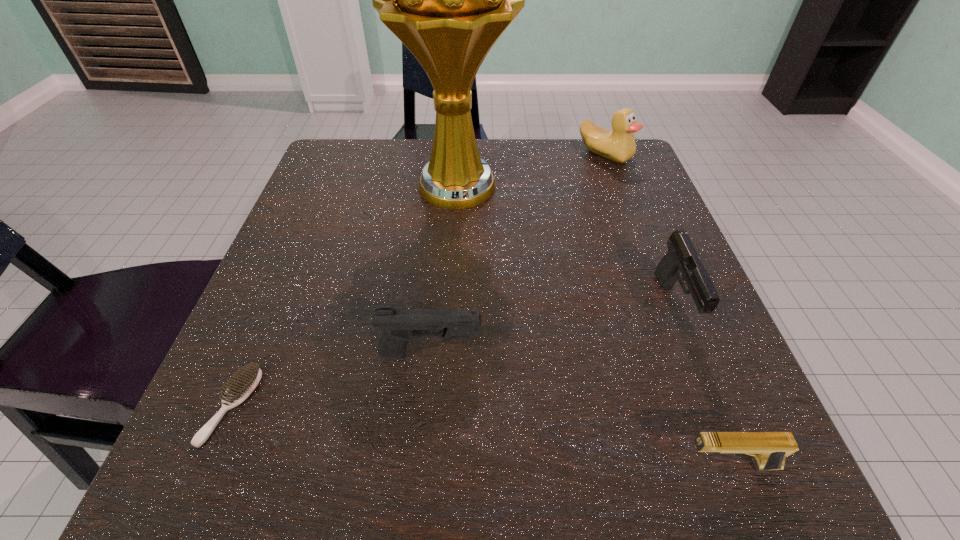
Where is `free spot located 0.260m at the beak of the duck`? free spot located 0.260m at the beak of the duck is located at coordinates (639, 245).

Find the location of `free space located aim along the barrel of the farthest pistol`. free space located aim along the barrel of the farthest pistol is located at coordinates (702, 375).

The width and height of the screenshot is (960, 540). I want to click on free space located at the barrel of the second farthest pistol, so click(x=637, y=355).

Find the location of a particular element. vacant space located at the barrel of the second shortest object is located at coordinates (401, 465).

This screenshot has height=540, width=960. Find the location of `vacant region located 0.230m at the barrel of the second shortest object`. vacant region located 0.230m at the barrel of the second shortest object is located at coordinates (492, 465).

Where is `vacant space located at the barrel of the second shortest object`? vacant space located at the barrel of the second shortest object is located at coordinates (435, 465).

In order to click on free point located on the back of the fifth farthest object in this screenshot , I will do `click(313, 214)`.

Identify the location of trophy_cup located at the far edge. (448, 0).

You are a GUI agent. You are given a task and a screenshot of the screen. Output one action in this format:
    pyautogui.click(x=<x>, y=<y>)
    Task: Click on the duck present at the far edge
    The image size is (960, 540).
    Given the screenshot: What is the action you would take?
    pyautogui.click(x=618, y=145)

This screenshot has height=540, width=960. In order to click on pistol that is at the near edge in this screenshot , I will do `click(770, 449)`.